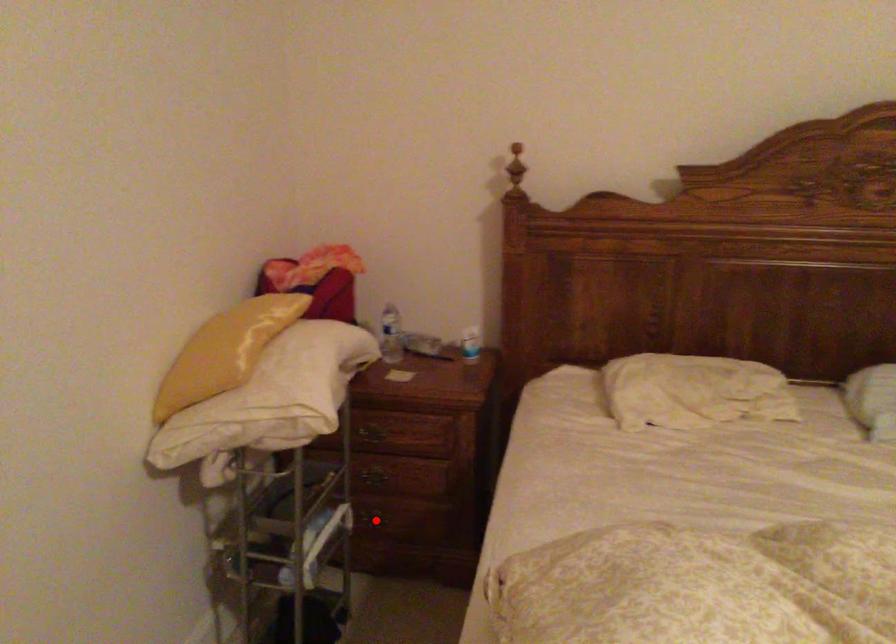
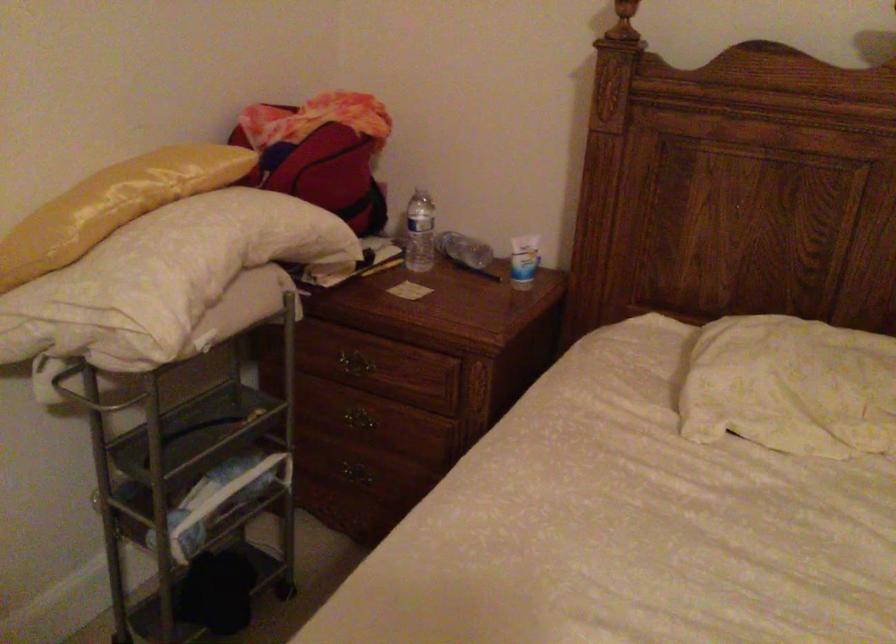
The point at the highlighted location is marked in the first image. Where is the corresponding point in the second image?

(355, 473)